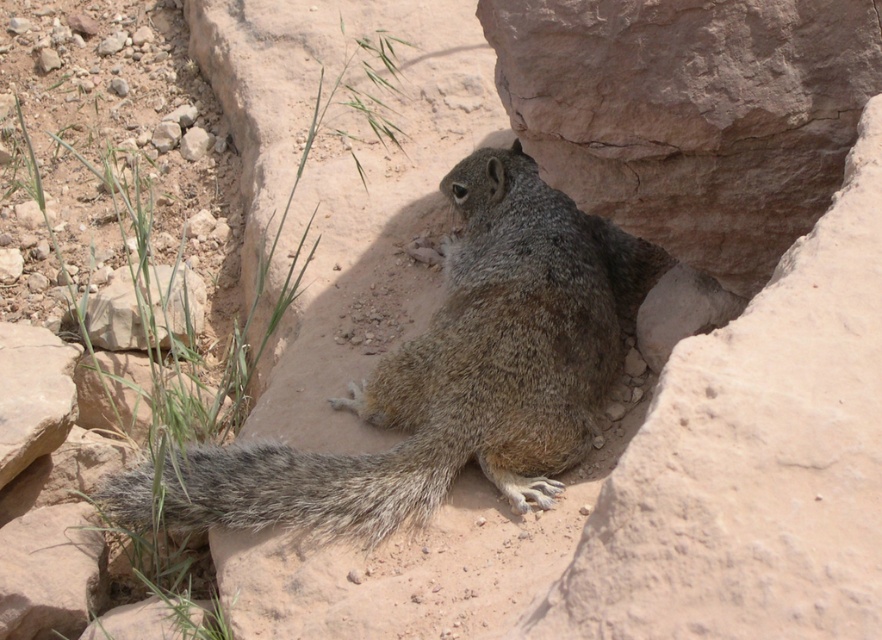
Question: Which point is closer to the camera taking this photo?

Choices:
 (A) (118, 522)
 (B) (163, 275)

Answer: (A)

Question: Which object is positioned farthest from the gray-furred squirrel at center?

Choices:
 (A) gray rock at lower left
 (B) gray fuzzy tail at center

Answer: (A)

Question: Is gray-furred squirrel at center positioned before gray fuzzy tail at center?

Choices:
 (A) no
 (B) yes

Answer: (B)

Question: Is gray-furred squirrel at center bigger than gray rock at lower left?

Choices:
 (A) no
 (B) yes

Answer: (B)

Question: Which of the following is the farthest from the observer?

Choices:
 (A) gray-furred squirrel at center
 (B) gray fuzzy tail at center
 (C) gray rock at lower left

Answer: (C)

Question: Does gray-furred squirrel at center have a larger size compared to gray rock at lower left?

Choices:
 (A) yes
 (B) no

Answer: (A)